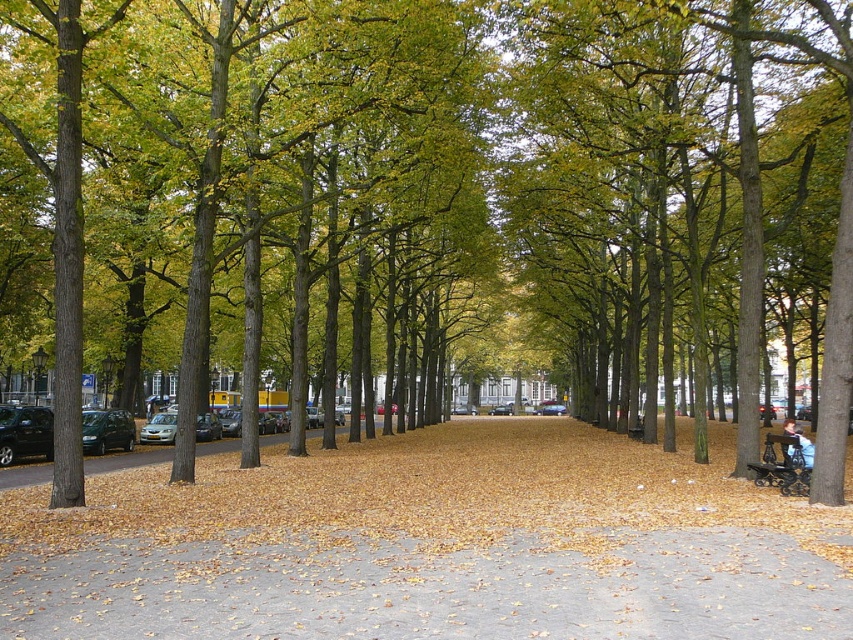
Question: Is the position of wooden park bench at lower right more distant than that of light brown leather jacket at lower right?

Choices:
 (A) yes
 (B) no

Answer: (A)

Question: Which point is farther from the camera taking this photo?

Choices:
 (A) 781,470
 (B) 809,452

Answer: (B)

Question: Does wooden park bench at lower right appear under light brown leather jacket at lower right?

Choices:
 (A) yes
 (B) no

Answer: (B)

Question: Considering the relative positions of wooden park bench at lower right and light brown leather jacket at lower right in the image provided, where is wooden park bench at lower right located with respect to light brown leather jacket at lower right?

Choices:
 (A) left
 (B) right

Answer: (A)